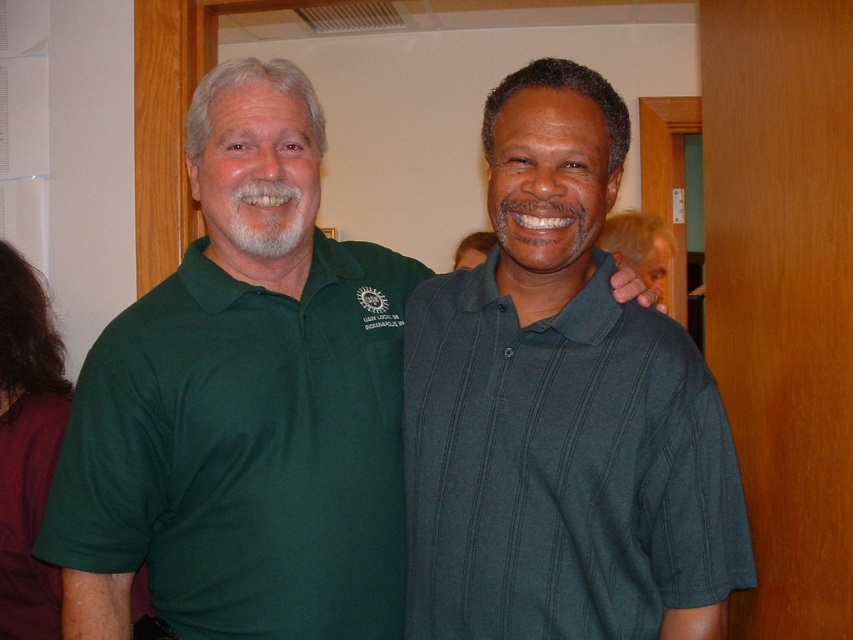
Who is more forward, (305, 552) or (582, 387)?

Point (582, 387) is in front.

Is green polo shirt at left to the right of dark green ribbed polo shirt at center from the viewer's perspective?

Incorrect, green polo shirt at left is not on the right side of dark green ribbed polo shirt at center.

In order to click on green polo shirt at left in this screenshot , I will do `click(247, 449)`.

Which is behind, point (300, 637) or point (709, 509)?

Point (300, 637)

Is point (235, 556) less distant than point (573, 566)?

No, it is not.

Is point (297, 384) closer to viewer compared to point (433, 428)?

That is False.

Where is `green matte polo shirt at center`? The height and width of the screenshot is (640, 853). green matte polo shirt at center is located at coordinates (242, 404).

Can you confirm if green matte polo shirt at center is smaller than green polo shirt at left?

Incorrect, green matte polo shirt at center is not smaller in size than green polo shirt at left.

What do you see at coordinates (242, 404) in the screenshot?
I see `green matte polo shirt at center` at bounding box center [242, 404].

Who is more forward, [250,563] or [370,426]?

Point [250,563] is more forward.

I want to click on green matte polo shirt at center, so click(242, 404).